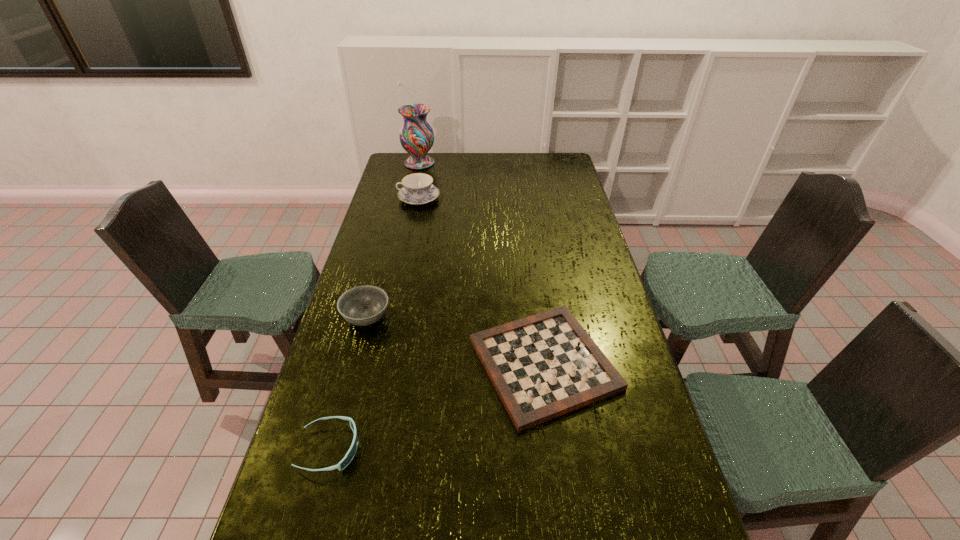
Find the location of a particular element. Image resolution: width=960 pixels, height=540 pixels. blank space located 0.070m with the handle on the side of the second tallest object is located at coordinates (382, 198).

Image resolution: width=960 pixels, height=540 pixels. I want to click on free space located on the right of the bowl, so (x=513, y=318).

What are the coordinates of `vacant space located on the back of the chessboard` in the screenshot? It's located at (535, 292).

Image resolution: width=960 pixels, height=540 pixels. Find the location of `free location located 0.190m on the front-facing side of the goggles`. free location located 0.190m on the front-facing side of the goggles is located at coordinates (436, 449).

Locate an element on the screen. Image resolution: width=960 pixels, height=540 pixels. object situated at the far edge is located at coordinates (416, 135).

The height and width of the screenshot is (540, 960). Identify the location of vase that is at the left edge. (416, 135).

Locate an element on the screen. This screenshot has width=960, height=540. chinaware that is at the left edge is located at coordinates (418, 189).

The image size is (960, 540). Find the location of `bowl at the left edge`. bowl at the left edge is located at coordinates (364, 305).

Image resolution: width=960 pixels, height=540 pixels. What are the coordinates of `goggles situated at the left edge` in the screenshot? It's located at (350, 454).

This screenshot has width=960, height=540. I want to click on object that is at the right edge, so click(542, 366).